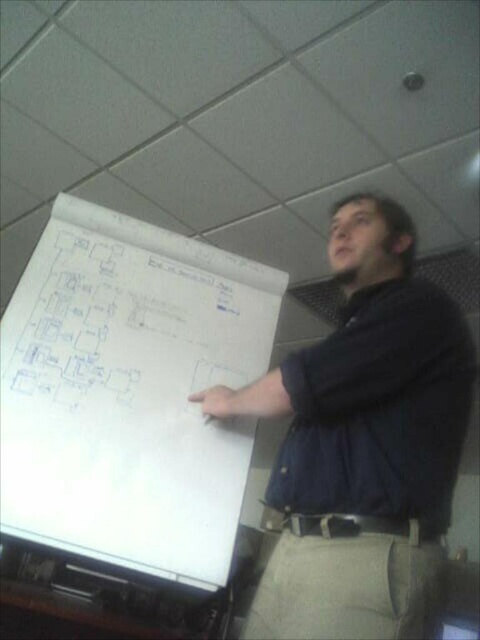
Is white paper at center to the right of dark blue shirt at upper center from the viewer's perspective?

In fact, white paper at center is to the left of dark blue shirt at upper center.

Which is in front, point (94, 205) or point (372, 593)?

Point (372, 593) is more forward.

Between point (134, 392) and point (207, 397), which one is positioned behind?

Point (134, 392)

You are a GUI agent. You are given a task and a screenshot of the screen. Output one action in this format:
    pyautogui.click(x=<x>, y=<y>)
    Task: Click on the white paper at center
    The height and width of the screenshot is (640, 480).
    Given the screenshot: What is the action you would take?
    pyautogui.click(x=130, y=394)

What do you see at coordinates (363, 442) in the screenshot? This screenshot has height=640, width=480. I see `dark blue shirt at upper center` at bounding box center [363, 442].

Between point (457, 461) and point (273, 493), which one is positioned behind?

Positioned behind is point (273, 493).

Where is `dark blue shirt at upper center`? dark blue shirt at upper center is located at coordinates (363, 442).

Which of these two, white paper at center or blue ink drawing at upper left, stands taller?

Standing taller between the two is white paper at center.

Is white paper at center smaller than blue ink drawing at upper left?

No.

Identify the location of white paper at center. Image resolution: width=480 pixels, height=640 pixels. (130, 394).